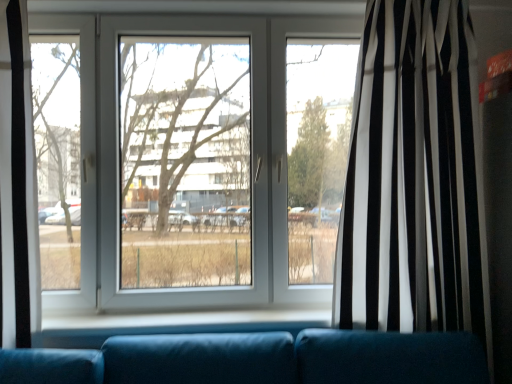
At what (x,y) coordinates should I click in order to perform the action: click on black/white striped curtain at right. Please return your answer as a coordinate pair (x, y). Looking at the image, I should click on (414, 178).

The image size is (512, 384). What do you see at coordinates (414, 178) in the screenshot?
I see `black/white striped curtain at right` at bounding box center [414, 178].

Locate an element on the screen. transparent glass window at center is located at coordinates (197, 159).

The image size is (512, 384). Describe the element at coordinates (197, 159) in the screenshot. I see `transparent glass window at center` at that location.

Image resolution: width=512 pixels, height=384 pixels. I want to click on black/white striped curtain at right, so click(x=414, y=178).

Which is more to the right, transparent glass window at center or black/white striped curtain at right?

black/white striped curtain at right.

Considering the positions of objects transparent glass window at center and black/white striped curtain at right in the image provided, who is behind, transparent glass window at center or black/white striped curtain at right?

Positioned behind is transparent glass window at center.

Is point (81, 208) farther from camera compared to point (379, 266)?

Yes.

From the image's perspective, between transparent glass window at center and black/white striped curtain at right, which one is located above?

From the image's view, transparent glass window at center is above.

From a real-world perspective, is transparent glass window at center located higher than black/white striped curtain at right?

Yes, from a real-world perspective, transparent glass window at center is above black/white striped curtain at right.

Considering the sizes of objects transparent glass window at center and black/white striped curtain at right in the image provided, who is thinner, transparent glass window at center or black/white striped curtain at right?

transparent glass window at center.

Consider the image. Which of these two, transparent glass window at center or black/white striped curtain at right, stands shorter?

transparent glass window at center.

Considering the sizes of transparent glass window at center and black/white striped curtain at right in the image, is transparent glass window at center bigger or smaller than black/white striped curtain at right?

Considering their sizes, transparent glass window at center takes up more space than black/white striped curtain at right.

Is transparent glass window at center surrounding black/white striped curtain at right?

No.

Is transparent glass window at center not near black/white striped curtain at right?

No, transparent glass window at center is not far from black/white striped curtain at right.

Is transparent glass window at center oriented towards black/white striped curtain at right?

No, transparent glass window at center is not turned towards black/white striped curtain at right.

Locate an element on the screen. The image size is (512, 384). curtain below the transparent glass window at center (from the image's perspective) is located at coordinates (414, 178).

Is black/white striped curtain at right to the right of transparent glass window at center from the viewer's perspective?

Yes.

Is black/white striped curtain at right further to camera compared to transparent glass window at center?

No, it is not.

Is point (354, 94) positioned before point (156, 278)?

Yes, it is.

From the image's perspective, relative to transparent glass window at center, is black/white striped curtain at right above or below?

Based on their image positions, black/white striped curtain at right is located beneath transparent glass window at center.

From a real-world perspective, is black/white striped curtain at right positioned above or below transparent glass window at center?

black/white striped curtain at right is situated lower than transparent glass window at center in the real world.

Considering the sizes of black/white striped curtain at right and transparent glass window at center in the image, is black/white striped curtain at right wider or thinner than transparent glass window at center?

In the image, black/white striped curtain at right appears to be wider than transparent glass window at center.

Considering the sizes of black/white striped curtain at right and transparent glass window at center in the image, is black/white striped curtain at right taller or shorter than transparent glass window at center?

black/white striped curtain at right is taller than transparent glass window at center.

Between black/white striped curtain at right and transparent glass window at center, which one has smaller size?

Smaller between the two is black/white striped curtain at right.

Is transparent glass window at center completely or partially inside black/white striped curtain at right?

No, transparent glass window at center is located outside of black/white striped curtain at right.

Is black/white striped curtain at right far away from transparent glass window at center?

Actually, black/white striped curtain at right and transparent glass window at center are a little close together.

Is black/white striped curtain at right facing away from transparent glass window at center?

No, black/white striped curtain at right is not facing away from transparent glass window at center.

I want to click on curtain in front of the transparent glass window at center, so click(414, 178).

Locate an element on the screen. The width and height of the screenshot is (512, 384). window that is behind the black/white striped curtain at right is located at coordinates (197, 159).

Locate an element on the screen. The height and width of the screenshot is (384, 512). window lying on the left of black/white striped curtain at right is located at coordinates (197, 159).